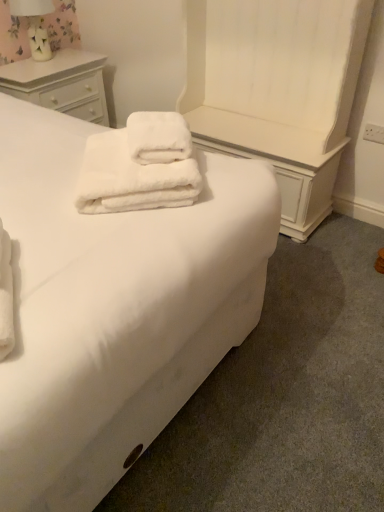
The width and height of the screenshot is (384, 512). What are the coordinates of `vacant area in front of floral fabric lampshade at upper left` in the screenshot? It's located at (38, 69).